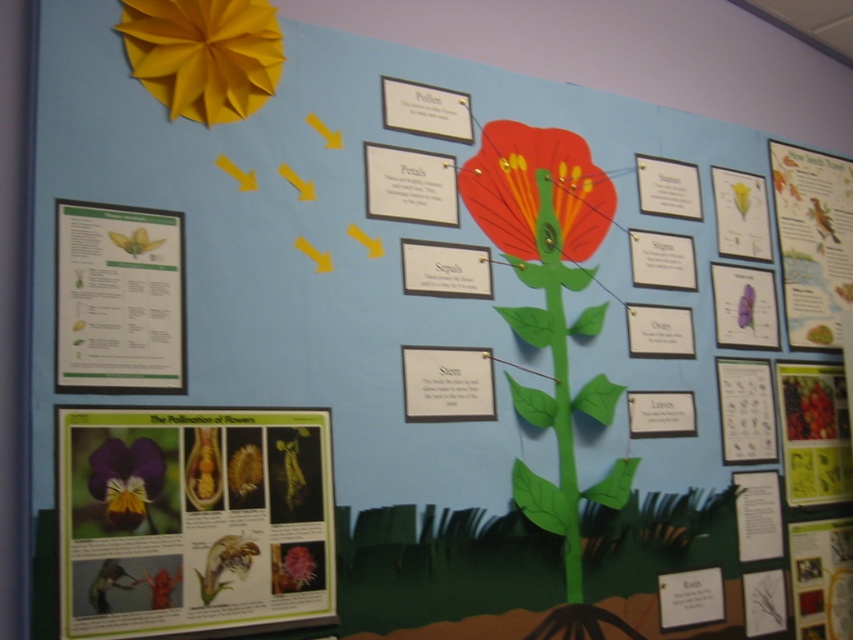
Question: Which object appears closest to the camera in this image?

Choices:
 (A) green paper poster at lower left
 (B) matte paper bird at upper right

Answer: (A)

Question: Which point is farther to the camera?

Choices:
 (A) matte yellow flower at left
 (B) purple matte flower at lower left
 (C) matte paper bird at upper right
 (D) matte paper flower at center

Answer: (C)

Question: Is purple matte flower at lower left above matte paper bird at upper right?

Choices:
 (A) yes
 (B) no

Answer: (B)

Question: Is matte yellow paper flower at upper left positioned at the back of purple matte/vibrant flower at lower left?

Choices:
 (A) yes
 (B) no

Answer: (A)

Question: Does matte yellow paper flower at upper left come in front of matte paper bird at upper right?

Choices:
 (A) no
 (B) yes

Answer: (B)

Question: Which point is closer to the camera taking this photo?

Choices:
 (A) (788, 148)
 (B) (611, 196)
 (C) (315, 573)
 (D) (123, 244)

Answer: (D)